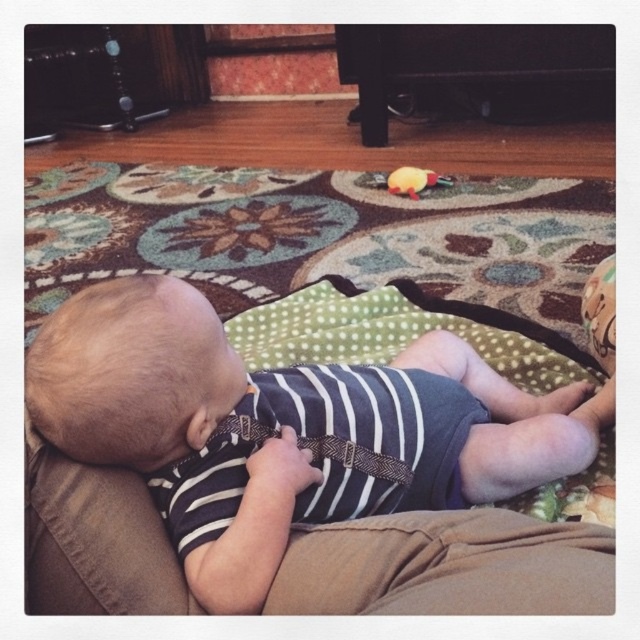
How much distance is there between striped fabric baby at center and yellow rubber duck at center?

The distance of striped fabric baby at center from yellow rubber duck at center is 1.32 meters.

Based on the photo, who is more forward, (x=180, y=323) or (x=428, y=173)?

Point (x=180, y=323) is more forward.

What do you see at coordinates (282, 428) in the screenshot? This screenshot has height=640, width=640. I see `striped fabric baby at center` at bounding box center [282, 428].

Identify the location of striped fabric baby at center. (282, 428).

How far apart are striped fabric baby at center and brown cotton pants at lower center?

striped fabric baby at center is 8.99 inches away from brown cotton pants at lower center.

The height and width of the screenshot is (640, 640). I want to click on striped fabric baby at center, so click(x=282, y=428).

Between point (378, 385) and point (355, 556), which one is positioned behind?

The point (378, 385) is more distant.

The image size is (640, 640). In order to click on striped fabric baby at center in this screenshot , I will do `click(282, 428)`.

Which is below, brown cotton pants at lower center or yellow rubber duck at center?

brown cotton pants at lower center is lower down.

Is brown cotton pants at lower center above yellow rubber duck at center?

No.

Between point (374, 561) and point (433, 184), which one is positioned behind?

Positioned behind is point (433, 184).

Locate an element on the screen. The width and height of the screenshot is (640, 640). brown cotton pants at lower center is located at coordinates (448, 566).